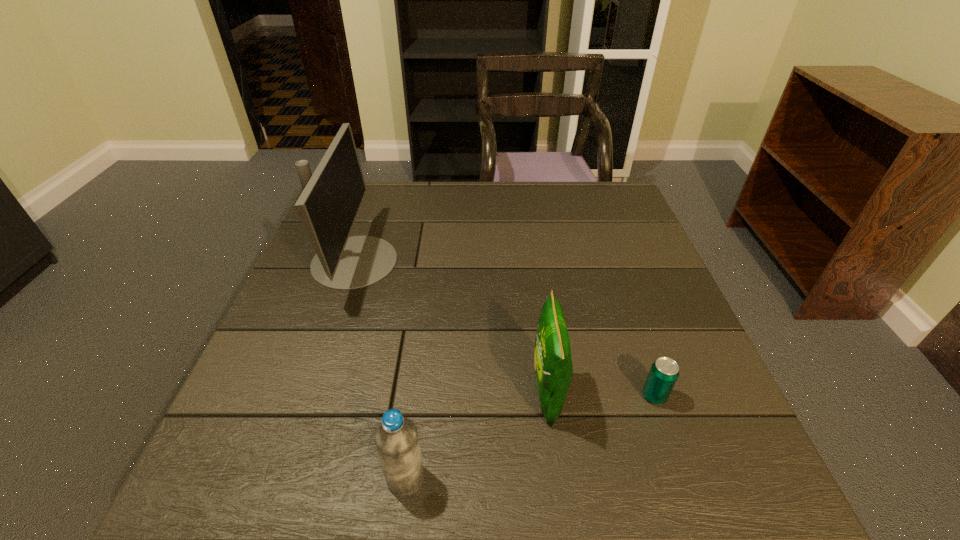
Identify the location of free area in between the third object from left to right and the beer can. The height and width of the screenshot is (540, 960). (601, 395).

Locate an element on the screen. Image resolution: width=960 pixels, height=540 pixels. vacant area that lies between the rightmost object and the third object from left to right is located at coordinates (601, 395).

In order to click on empty location between the farthest object and the water bottle in this screenshot , I will do `click(380, 370)`.

You are a GUI agent. You are given a task and a screenshot of the screen. Output one action in this format:
    pyautogui.click(x=<x>, y=<y>)
    Task: Click on the free space between the rightmost object and the farthest object
    This screenshot has width=960, height=540.
    Given the screenshot: What is the action you would take?
    pyautogui.click(x=504, y=329)

This screenshot has height=540, width=960. Identify the location of object that stands as the second closest to the nearest object. (328, 206).

Find the location of a particular element. The image size is (960, 540). the third closest object to the nearest object is located at coordinates (664, 372).

Where is `vacant space that satisfies the following two spatial constraints: 1. on the screen of the beer can; 2. on the left side of the computer monitor`? vacant space that satisfies the following two spatial constraints: 1. on the screen of the beer can; 2. on the left side of the computer monitor is located at coordinates (308, 396).

This screenshot has width=960, height=540. I want to click on free space that satisfies the following two spatial constraints: 1. on the front-facing side of the beer can; 2. on the right side of the crisp (potato chip), so click(547, 396).

Locate an element on the screen. vacant space that satisfies the following two spatial constraints: 1. on the screen of the nearest object; 2. on the left side of the farthest object is located at coordinates (280, 478).

You are a GUI agent. You are given a task and a screenshot of the screen. Output one action in this format:
    pyautogui.click(x=<x>, y=<y>)
    Task: Click on the vacant space that satisfies the following two spatial constraints: 1. on the front-facing side of the shortest object; 2. on the left side of the second object from right to left
    
    Given the screenshot: What is the action you would take?
    pyautogui.click(x=547, y=396)